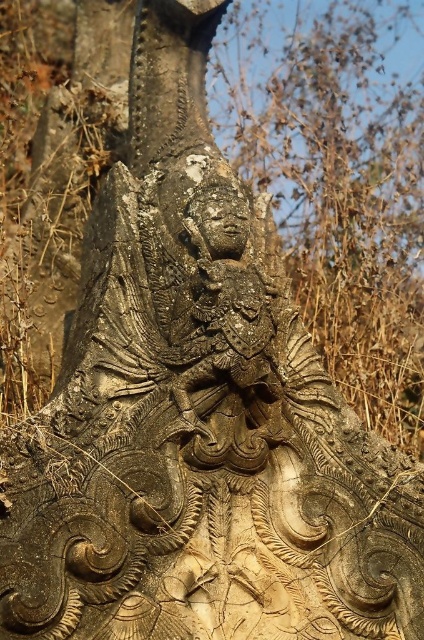
Question: Which point appears farthest from the camera in this image?

Choices:
 (A) (201, 202)
 (B) (242, 392)

Answer: (A)

Question: Where is carved stone deity at center located in relation to carved stone face at center in the image?

Choices:
 (A) above
 (B) below

Answer: (B)

Question: Which of the following is the farthest from the observer?

Choices:
 (A) carved stone deity at center
 (B) carved stone face at center

Answer: (B)

Question: Which of the following is the closest to the observer?

Choices:
 (A) (201, 214)
 (B) (256, 333)

Answer: (B)

Question: Does carved stone deity at center have a larger size compared to carved stone face at center?

Choices:
 (A) no
 (B) yes

Answer: (B)

Question: Is carved stone deity at center smaller than carved stone face at center?

Choices:
 (A) no
 (B) yes

Answer: (A)